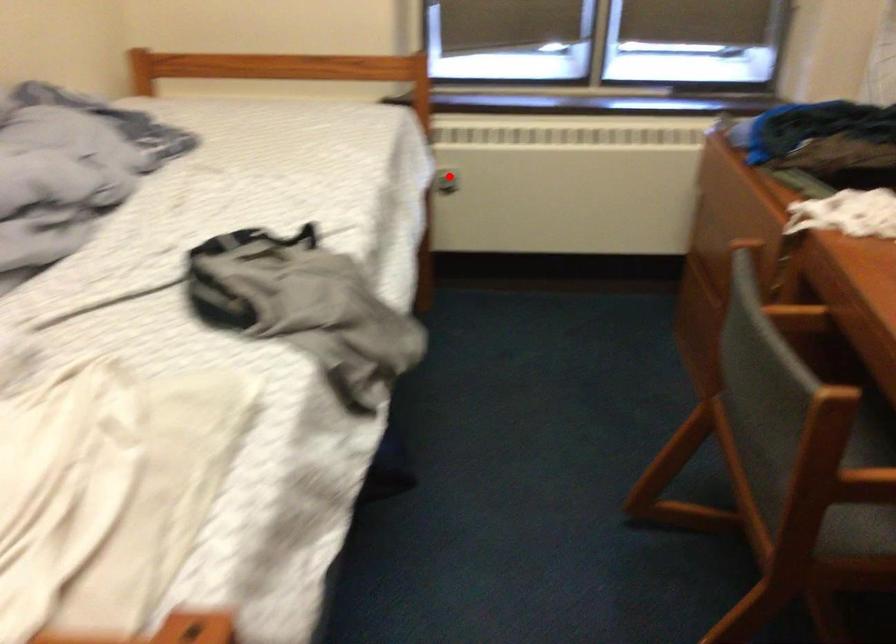
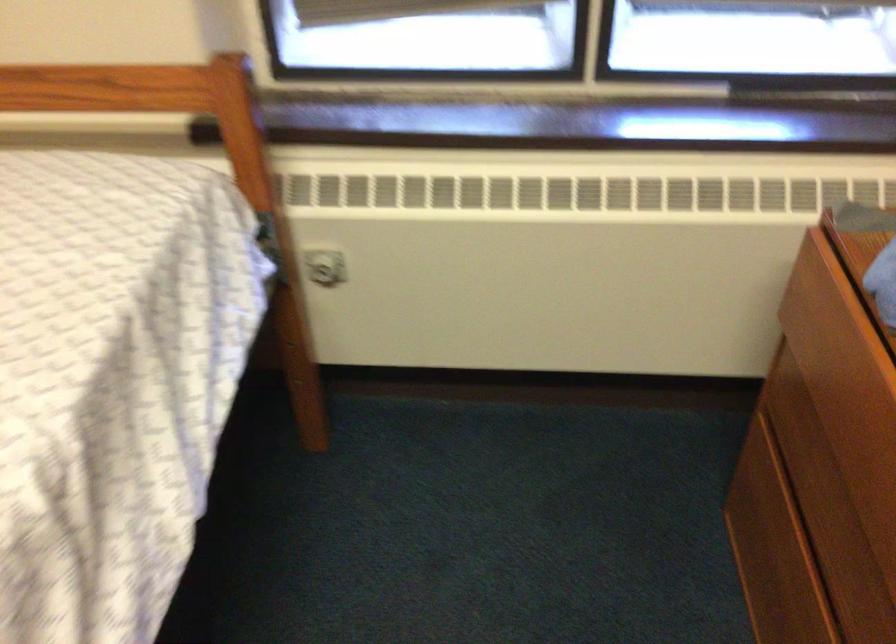
Locate, in the second image, the point that corresponds to the highlighted location in the first image.

(323, 267)